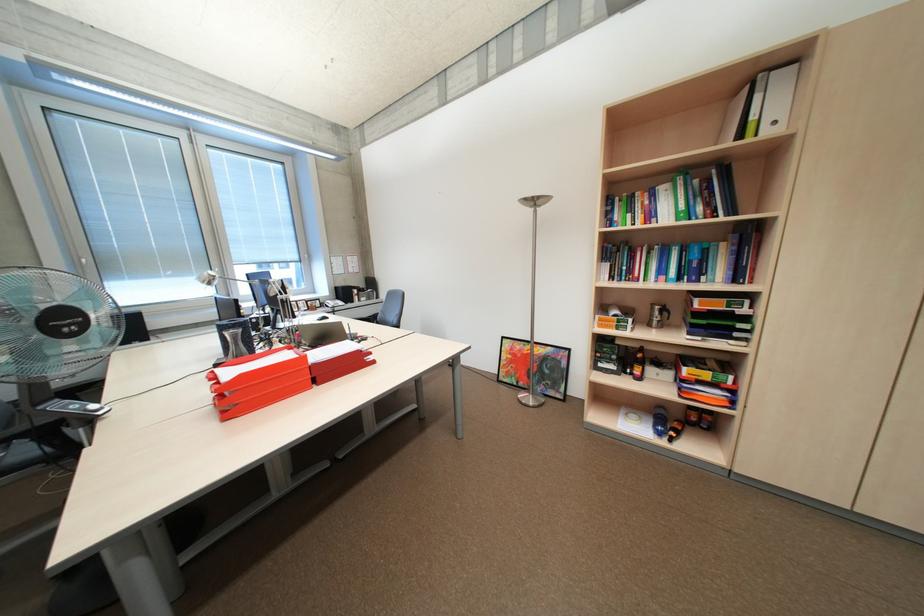
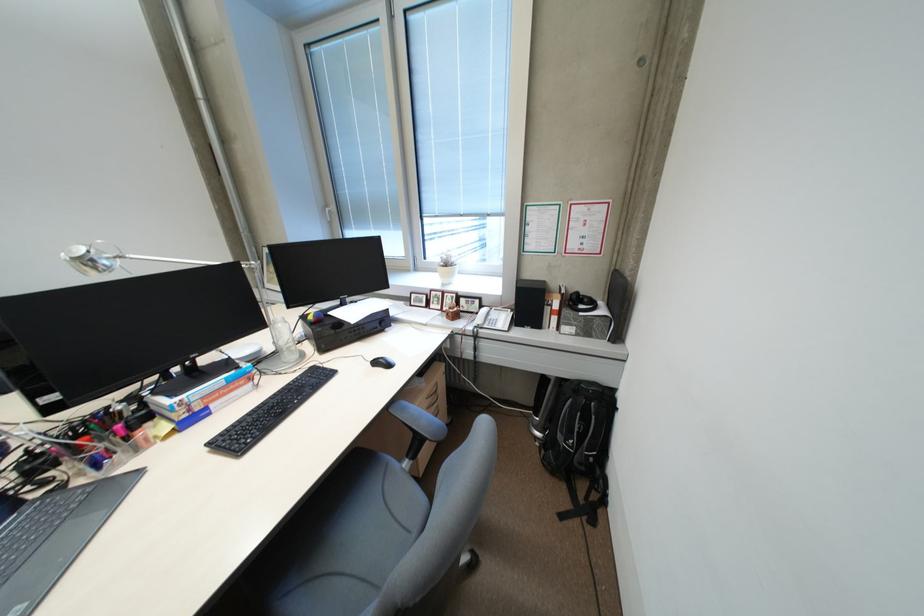
Where in the second image is the point corresponding to [307,301] from the first image?

(454, 292)